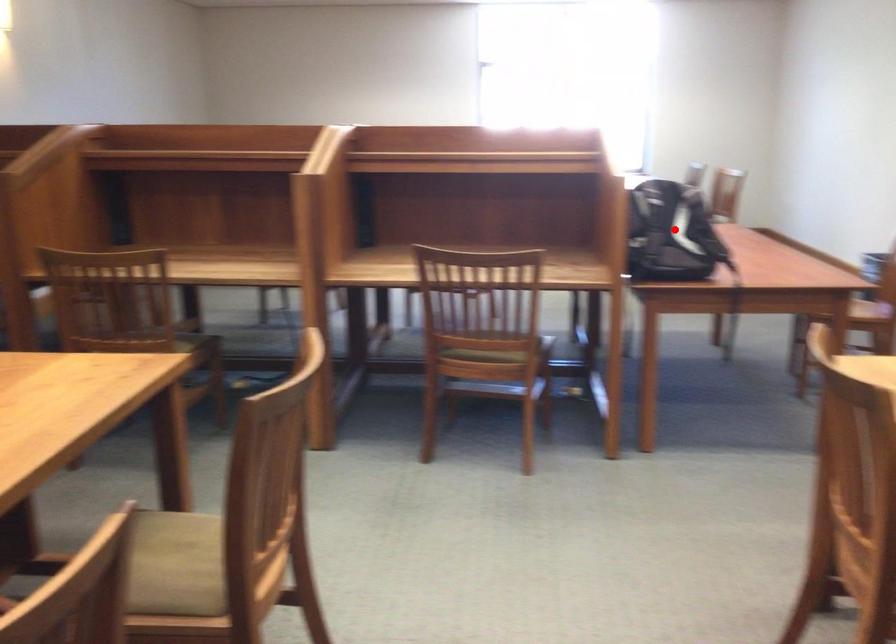
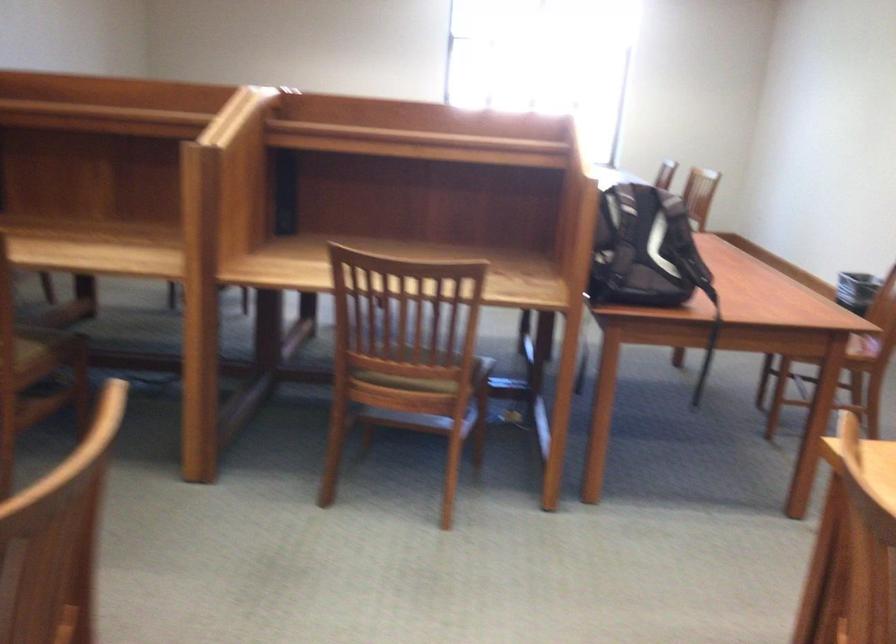
Where in the second image is the point corresponding to the highlighted location from the first image?

(644, 250)